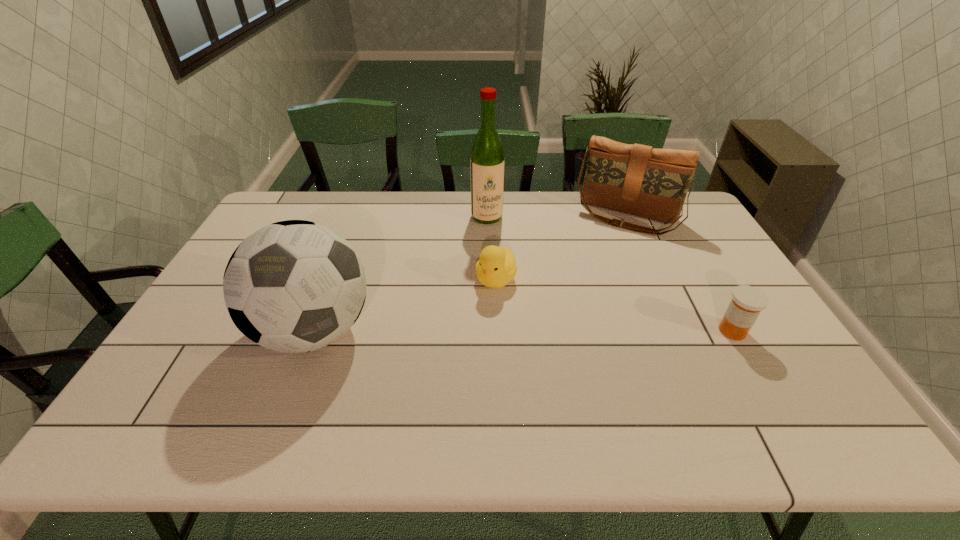
I want to click on shoulder bag that is at the right edge, so click(636, 179).

At what (x,y) coordinates should I click in order to perform the action: click on object that is at the far right corner. Please return your answer as a coordinate pair (x, y). Looking at the image, I should click on (636, 179).

This screenshot has width=960, height=540. In the image, there is a desktop. In order to click on vacant space at the far edge in this screenshot , I will do `click(447, 191)`.

Where is `vacant area at the near edge of the desktop`? The height and width of the screenshot is (540, 960). vacant area at the near edge of the desktop is located at coordinates (228, 369).

The width and height of the screenshot is (960, 540). What are the coordinates of `vacant area at the right edge of the desktop` in the screenshot? It's located at (780, 356).

Find the location of a particular element. This screenshot has height=540, width=960. blank space at the near left corner is located at coordinates (174, 381).

This screenshot has width=960, height=540. In order to click on vacant space at the near right corner of the desktop in this screenshot , I will do [x=796, y=375].

Locate an element on the screen. Image resolution: width=960 pixels, height=540 pixels. vacant area between the medicine and the leftmost object is located at coordinates (523, 331).

Find the location of `free space between the medicine and the shoulder bag`. free space between the medicine and the shoulder bag is located at coordinates (679, 274).

Where is `free space that is in between the third shortest object and the medicine`? This screenshot has height=540, width=960. free space that is in between the third shortest object and the medicine is located at coordinates (679, 274).